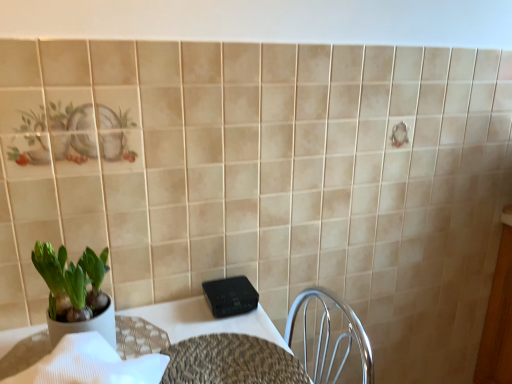
Where is `vacant point above leopard print table at center (from a real-world perspective)`? vacant point above leopard print table at center (from a real-world perspective) is located at coordinates (230, 362).